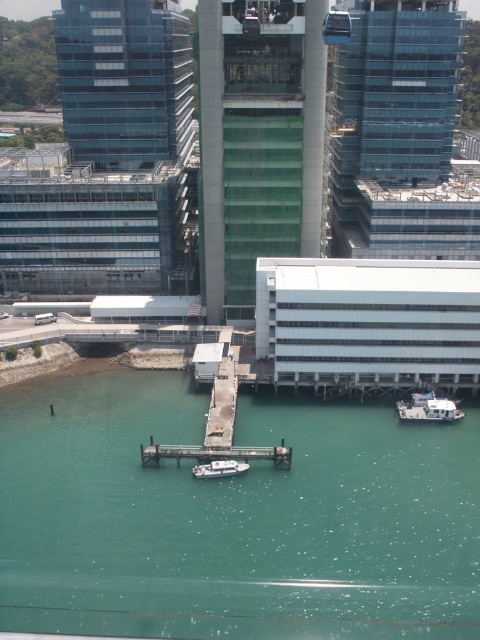
Question: Does white matte boat at lower right appear under white glossy boat at center?

Choices:
 (A) yes
 (B) no

Answer: (B)

Question: Does green water at lower center have a greater width compared to concrete dock at center?

Choices:
 (A) no
 (B) yes

Answer: (B)

Question: Which of the following is the closest to the observer?

Choices:
 (A) click(x=420, y=536)
 (B) click(x=439, y=401)
 (C) click(x=218, y=448)
 (D) click(x=202, y=456)

Answer: (A)

Question: Among these objects, which one is nearest to the camera?

Choices:
 (A) white glossy boat at center
 (B) smooth gray dock at center

Answer: (A)

Question: Which point is farther to the camera?

Choices:
 (A) (408, 564)
 (B) (215, 435)
 (C) (284, 440)
 (D) (408, 406)

Answer: (D)

Question: Does concrete dock at center lie behind white matte boat at lower right?

Choices:
 (A) yes
 (B) no

Answer: (B)